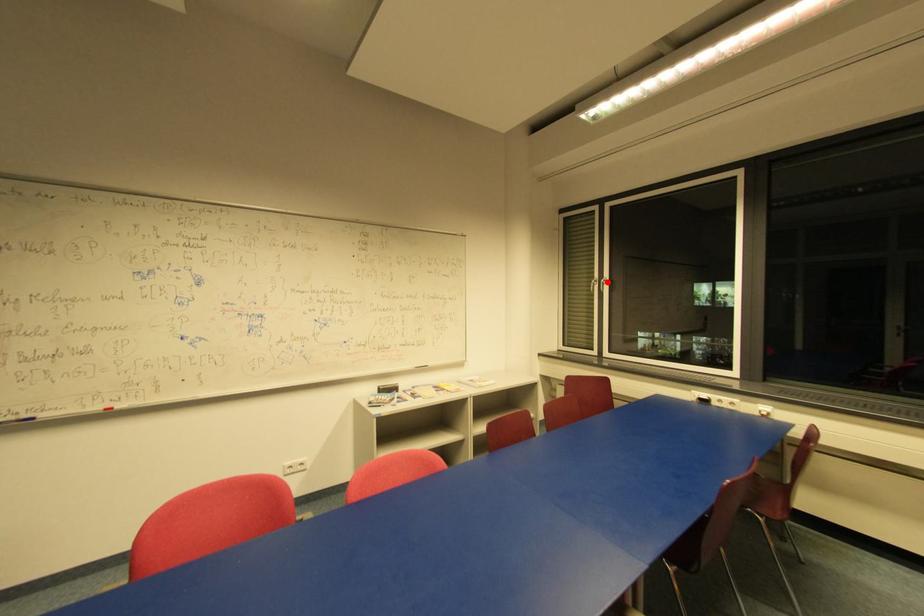
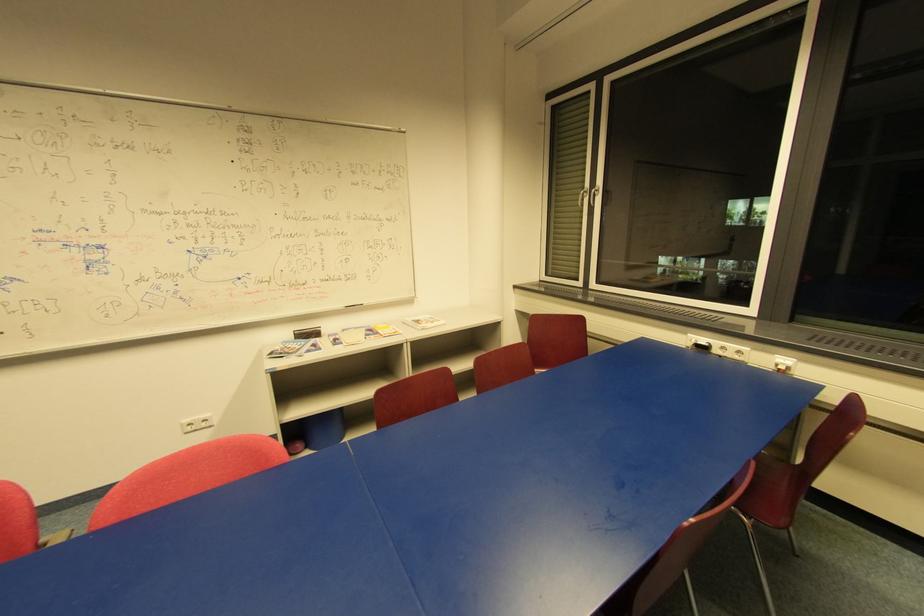
Locate, in the second image, the point that corresponds to the highlighted location in the first image.

(598, 192)